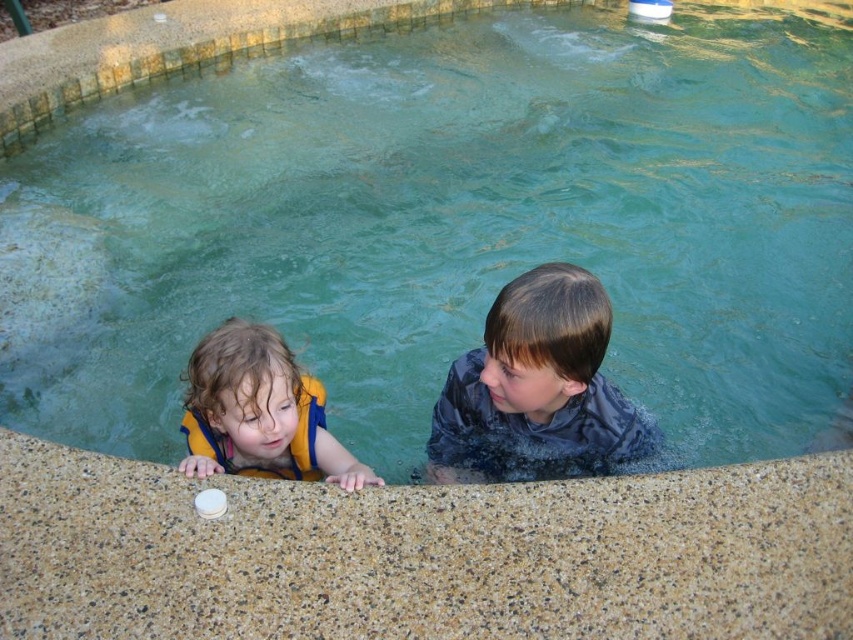
Who is lower down, dark blue wet shirt at upper center or yellow life vest at left?

yellow life vest at left is lower down.

Does dark blue wet shirt at upper center have a larger size compared to yellow life vest at left?

Yes, dark blue wet shirt at upper center is bigger than yellow life vest at left.

Does point (573, 371) come closer to viewer compared to point (184, 460)?

Yes, it is.

Find the location of a particular element. The width and height of the screenshot is (853, 640). dark blue wet shirt at upper center is located at coordinates (537, 388).

Is dark blue wet shirt at upper center shorter than yellow life jacket at left?

No.

Who is more forward, (560,282) or (302,388)?

Point (560,282)

I want to click on dark blue wet shirt at upper center, so click(537, 388).

Which is below, yellow life vest at left or yellow life jacket at left?

Positioned lower is yellow life vest at left.

Does yellow life vest at left appear on the right side of yellow life jacket at left?

Correct, you'll find yellow life vest at left to the right of yellow life jacket at left.

The image size is (853, 640). What do you see at coordinates (259, 412) in the screenshot?
I see `yellow life vest at left` at bounding box center [259, 412].

Image resolution: width=853 pixels, height=640 pixels. I want to click on yellow life vest at left, so click(259, 412).